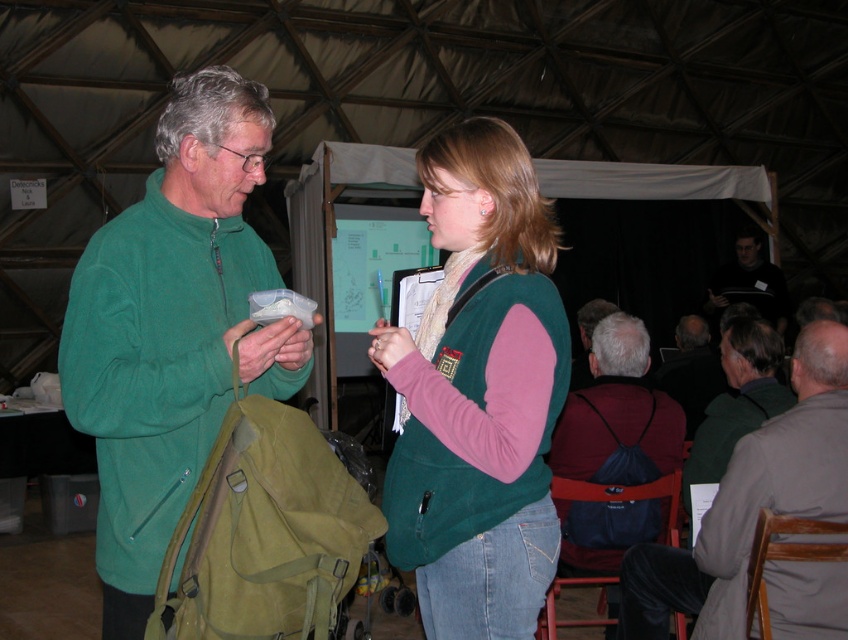
Does maroon fabric backpack at lower right have a smaller size compared to dark gray backpack at center?

Yes, maroon fabric backpack at lower right is smaller than dark gray backpack at center.

Based on the photo, who is positioned more to the left, maroon fabric backpack at lower right or dark gray backpack at center?

maroon fabric backpack at lower right

You are a GUI agent. You are given a task and a screenshot of the screen. Output one action in this format:
    pyautogui.click(x=<x>, y=<y>)
    Task: Click on the maroon fabric backpack at lower right
    The image size is (848, 640).
    Given the screenshot: What is the action you would take?
    pyautogui.click(x=615, y=449)

Looking at this image, how far apart are green fleece jacket at left and dark gray sweater at center?

The distance of green fleece jacket at left from dark gray sweater at center is 5.60 meters.

The image size is (848, 640). In order to click on green fleece jacket at left in this screenshot , I will do `click(171, 330)`.

Does green fleece jacket at left have a lesser width compared to gray fabric backpack at center?

Incorrect, green fleece jacket at left's width is not less than gray fabric backpack at center's.

Does green fleece jacket at left appear on the right side of gray fabric backpack at center?

No, green fleece jacket at left is not to the right of gray fabric backpack at center.

Is point (112, 252) more distant than point (734, 509)?

That is False.

This screenshot has width=848, height=640. Identify the location of green fleece jacket at left. (171, 330).